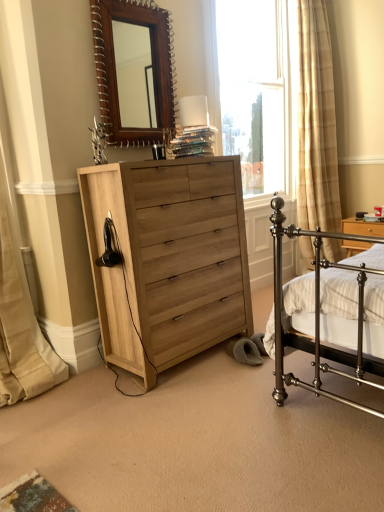
Question: Considering the positions of beige fabric curtain at left and white glossy table lamp at upper center in the image, is beige fabric curtain at left wider or thinner than white glossy table lamp at upper center?

Choices:
 (A) thin
 (B) wide

Answer: (B)

Question: From a real-world perspective, is beige fabric curtain at left positioned above or below white glossy table lamp at upper center?

Choices:
 (A) above
 (B) below

Answer: (B)

Question: Which is nearer to the natural wood chest of drawers at center?

Choices:
 (A) wooden nightstand at right
 (B) white glossy table lamp at upper center
 (C) wooden mirror at upper center
 (D) beige fabric curtain at left
 (E) clear glass window at upper center

Answer: (B)

Question: Considering the real-world distances, which object is closest to the beige fabric curtain at left?

Choices:
 (A) wooden nightstand at right
 (B) natural wood chest of drawers at center
 (C) white glossy table lamp at upper center
 (D) wooden mirror at upper center
 (E) clear glass window at upper center

Answer: (B)